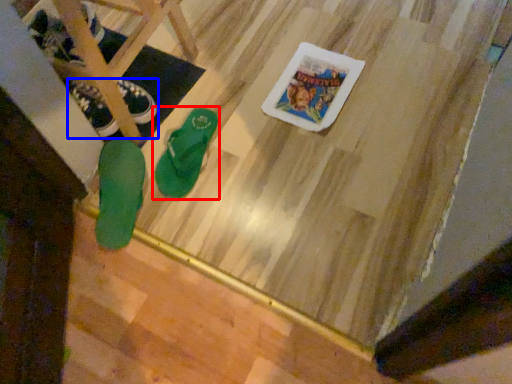
Question: Which of the following is the farthest to the observer, footwear (highlighted by a red box) or footwear (highlighted by a blue box)?

Choices:
 (A) footwear
 (B) footwear

Answer: (B)